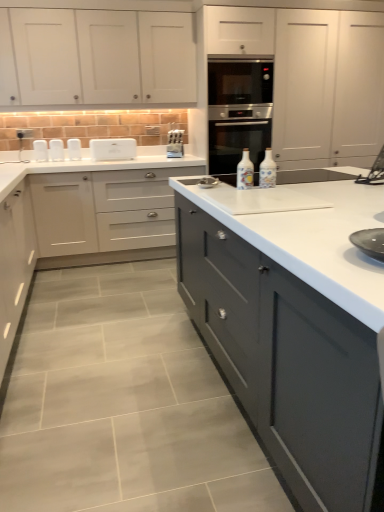
Question: Which direction should I rotate to face white ceramic bottle at center, positioned as the first bottle in left-to-right order, — up or down?

Choices:
 (A) down
 (B) up

Answer: (B)

Question: Does white matte cabinet at center, which is the second cabinetry from bottom to top, have a larger size compared to white matte cabinet at upper left, the fourth cabinetry ordered from the bottom?

Choices:
 (A) yes
 (B) no

Answer: (A)

Question: Considering the relative positions of white matte cabinet at center, acting as the 3th cabinetry starting from the top, and white matte cabinet at upper left, which is counted as the first cabinetry, starting from the top, in the image provided, is white matte cabinet at center, acting as the 3th cabinetry starting from the top, to the left of white matte cabinet at upper left, which is counted as the first cabinetry, starting from the top, from the viewer's perspective?

Choices:
 (A) no
 (B) yes

Answer: (A)

Question: From the image's perspective, is white matte cabinet at center, acting as the 3th cabinetry starting from the top, located beneath white matte cabinet at upper left, which is counted as the first cabinetry, starting from the top?

Choices:
 (A) no
 (B) yes

Answer: (B)

Question: Is white matte cabinet at center, which is the second cabinetry from bottom to top, to the right of white matte cabinet at upper left, the fourth cabinetry ordered from the bottom, from the viewer's perspective?

Choices:
 (A) no
 (B) yes

Answer: (B)

Question: Is white matte cabinet at center, acting as the 3th cabinetry starting from the top, not near white matte cabinet at upper left, the fourth cabinetry ordered from the bottom?

Choices:
 (A) no
 (B) yes

Answer: (A)

Question: Is white matte cabinet at center, which is the second cabinetry from bottom to top, aimed at white matte cabinet at upper left, which is counted as the first cabinetry, starting from the top?

Choices:
 (A) yes
 (B) no

Answer: (B)

Question: Can you see white matte cabinet at center, which is the second cabinetry from bottom to top, touching white plastic toaster at upper center, the 3th appliance in the left-to-right sequence?

Choices:
 (A) no
 (B) yes

Answer: (A)

Question: Considering the relative sizes of white matte cabinet at center, which is the second cabinetry from bottom to top, and white plastic toaster at upper center, marked as the second appliance in a right-to-left arrangement, in the image provided, is white matte cabinet at center, which is the second cabinetry from bottom to top, wider than white plastic toaster at upper center, marked as the second appliance in a right-to-left arrangement,?

Choices:
 (A) yes
 (B) no

Answer: (A)

Question: Does white matte cabinet at center, which is the second cabinetry from bottom to top, appear on the right side of white plastic toaster at upper center, the 3th appliance in the left-to-right sequence?

Choices:
 (A) no
 (B) yes

Answer: (B)

Question: Can you confirm if white matte cabinet at center, which is the second cabinetry from bottom to top, is taller than white plastic toaster at upper center, marked as the second appliance in a right-to-left arrangement?

Choices:
 (A) no
 (B) yes

Answer: (B)

Question: Can you confirm if white matte cabinet at center, which is the second cabinetry from bottom to top, is bigger than white plastic toaster at upper center, marked as the second appliance in a right-to-left arrangement?

Choices:
 (A) yes
 (B) no

Answer: (A)

Question: Is the depth of white matte cabinet at center, which is the second cabinetry from bottom to top, less than that of white plastic toaster at upper center, marked as the second appliance in a right-to-left arrangement?

Choices:
 (A) yes
 (B) no

Answer: (A)

Question: From the image's perspective, would you say matte white cabinets at center, the 1th cabinetry in the bottom-to-top sequence, is positioned over white plastic toaster at upper left, which is counted as the 4th appliance, starting from the right?

Choices:
 (A) yes
 (B) no

Answer: (B)